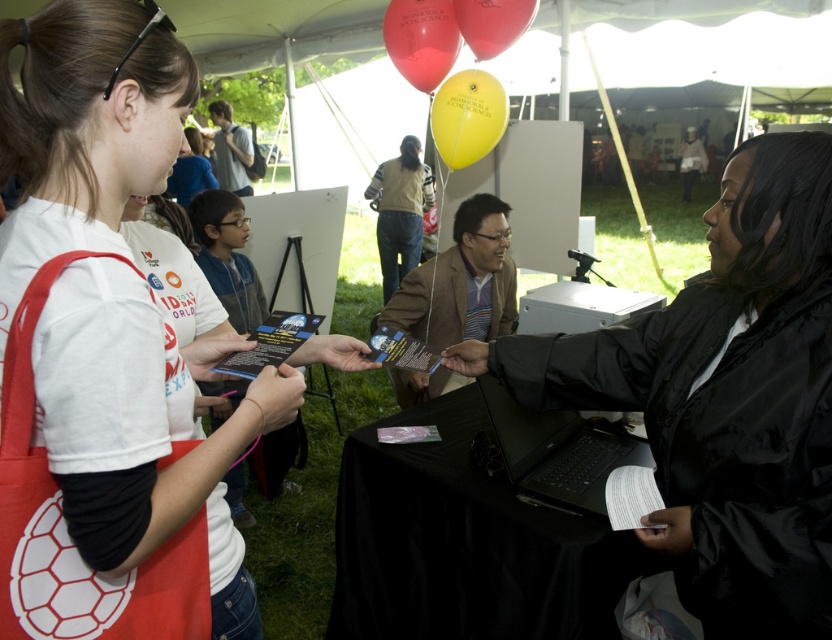
You are standing at the entrance of the tent and see the black matte jacket at center and the rubberized red balloon at upper center. Which object is closer to your left side?

The rubberized red balloon at upper center is closer to your left side because the black matte jacket at center is to the right of it.

You are at the science fair and see two balloons, a rubberized red balloon at upper center and a rubberized yellow balloon at upper center. Which balloon is closer to you?

The rubberized red balloon at upper center is closer to you because it is further to the viewer than the rubberized yellow balloon at upper center.